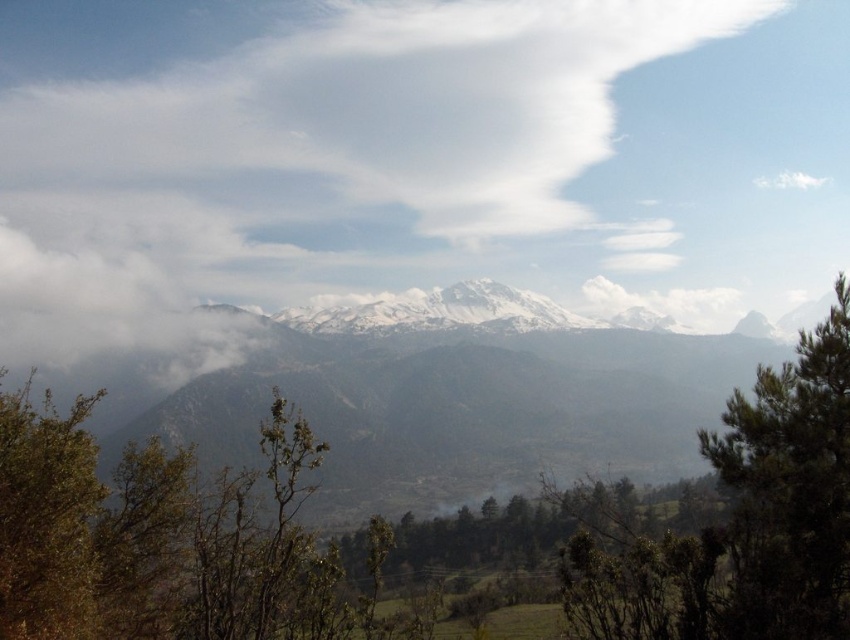
Looking at this image, you are an adventurer standing at the base of the snowy rock mountain range at center and the green leafy tree at right. Which object is closer to your left side?

The green leafy tree at right is closer to your left side because the snowy rock mountain range at center is positioned on the right side of it.

You are standing in the mountain landscape and want to place a small flag at both point (x=293, y=348) and point (x=786, y=528). Which point is closer to your current position?

Point (x=293, y=348) is closer to your current position because it is further to the camera than point (x=786, y=528), meaning it is physically nearer to you.

You are standing at the camera position and want to take a photo of the green leafy tree at right. If your camera has a maximum focus range of 500 feet, will you be able to focus on the tree?

The green leafy tree at right and camera are 478.82 feet apart from each other. Since the distance is within the camera maximum focus range of 500 feet, the camera can focus on the tree.